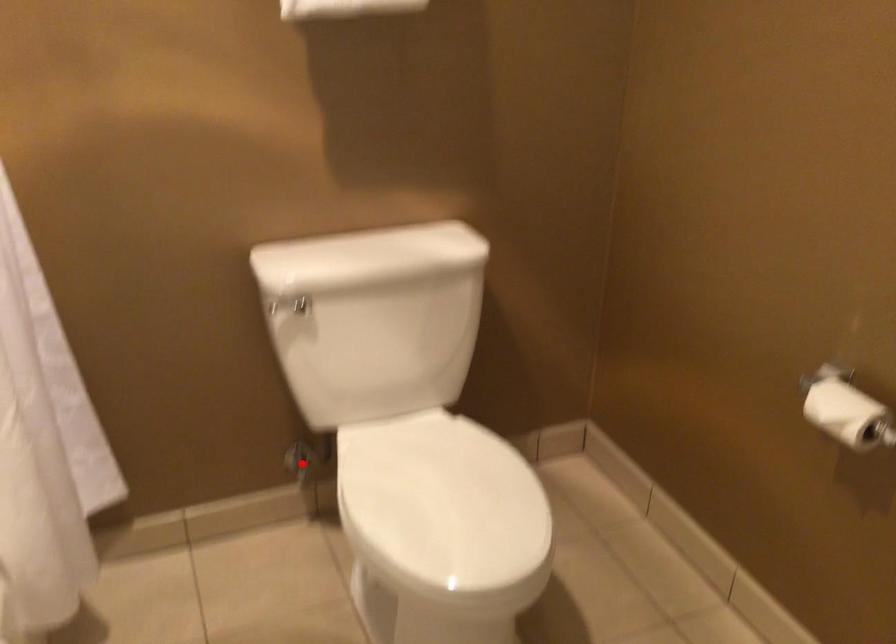
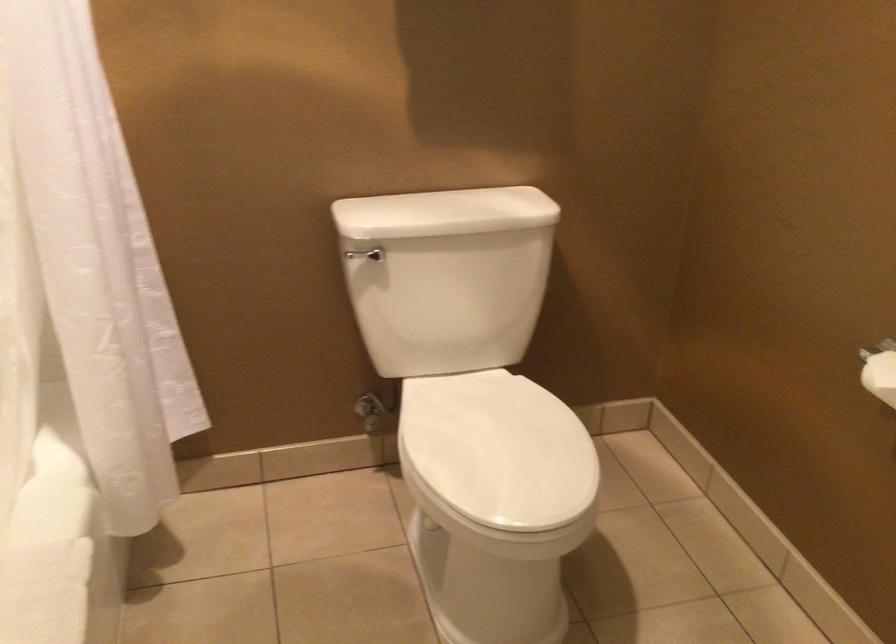
In the second image, find the point that corresponds to the highlighted location in the first image.

(371, 412)